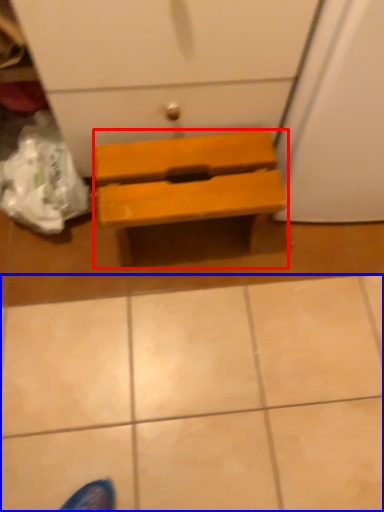
Question: Which object appears closest to the camera in this image, furniture (highlighted by a red box) or tile (highlighted by a blue box)?

Choices:
 (A) furniture
 (B) tile

Answer: (B)